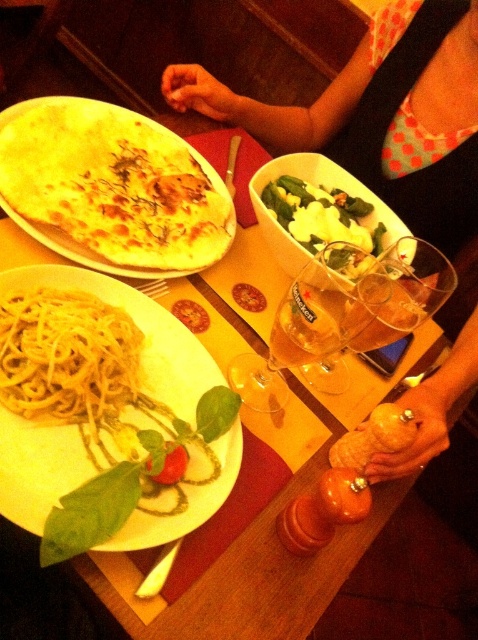
You are a diner sitting at the table and want to reach both the golden crispy pizza at upper left and the yellow matte spaghetti at center. Which dish will you need to lean forward more to reach?

You will need to lean forward more to reach the yellow matte spaghetti at center because it is farther away from you compared to the golden crispy pizza at upper left, which is closer.

You are a customer sitting at the table and want to reach for the yellow matte pasta at center and the golden crispy pizza at upper left. Which one is closer to you?

The yellow matte pasta at center is closer to you because it is in front of the golden crispy pizza at upper left.

You are a diner sitting at the table and want to reach for the yellow matte pasta at center and green leafy salad at center. Which one is wider?

The yellow matte pasta at center has a lesser width compared to the green leafy salad at center, so the green leafy salad at center is wider.